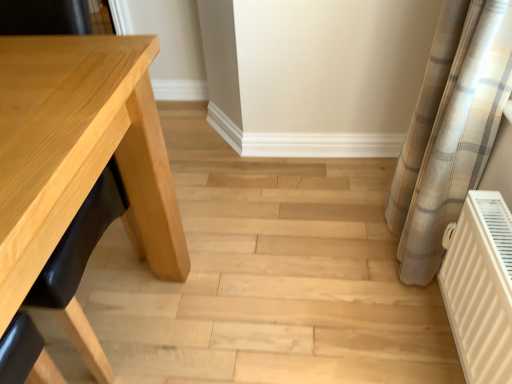
The image size is (512, 384). Find the location of `free space between plaid fabric curtain at right and light wood table at left`. free space between plaid fabric curtain at right and light wood table at left is located at coordinates (264, 283).